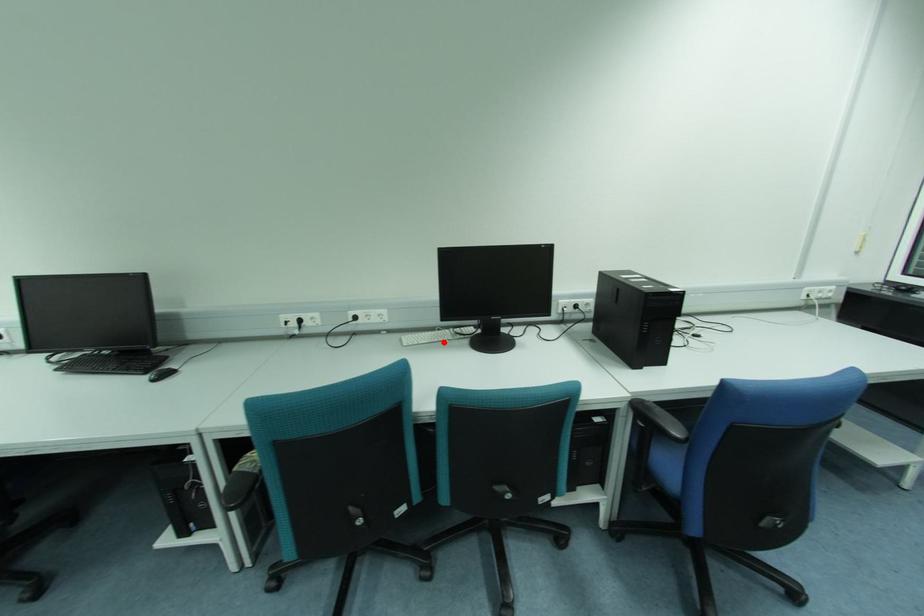
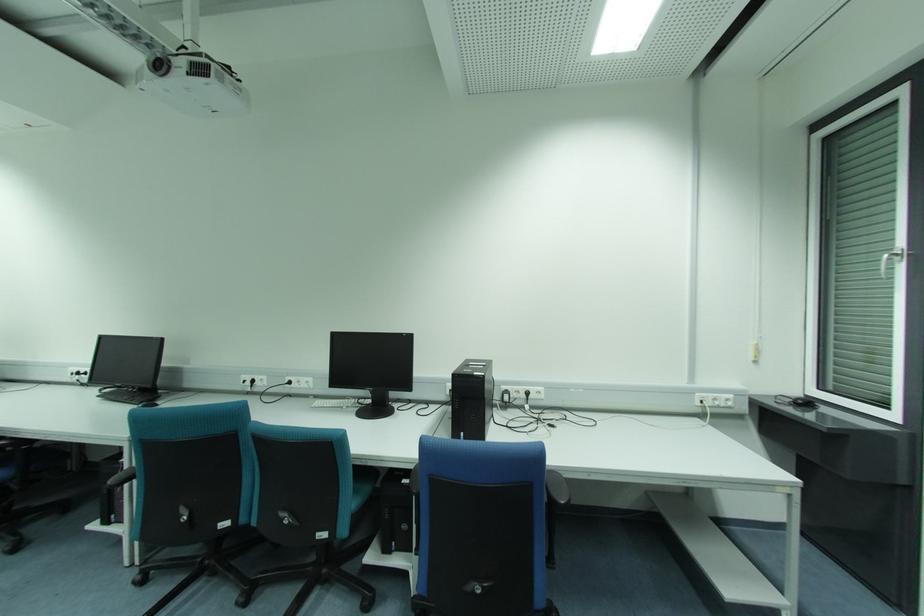
Where in the second image is the point corresponding to the highlighted location from the first image?

(343, 408)